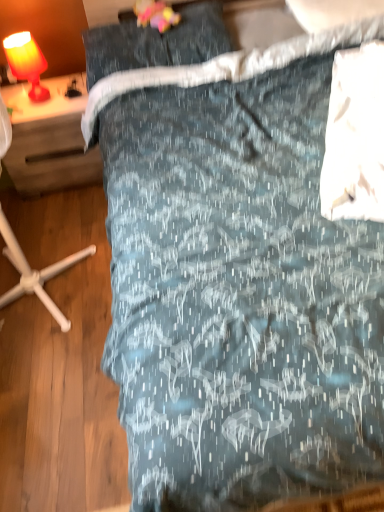
Describe the element at coordinates (49, 138) in the screenshot. I see `matte wood desk at left` at that location.

Measure the distance between matte wood desk at left and camera.

1.88 meters.

This screenshot has width=384, height=512. I want to click on matte orange lamp at upper left, so click(27, 62).

Looking at their sizes, would you say dark gray fabric pillow at upper center is wider or thinner than matte wood desk at left?

Considering their sizes, dark gray fabric pillow at upper center looks slimmer than matte wood desk at left.

From the image's perspective, would you say dark gray fabric pillow at upper center is shown under matte wood desk at left?

No.

Is matte wood desk at left at the back of dark gray fabric pillow at upper center?

No, dark gray fabric pillow at upper center is not facing the opposite direction of matte wood desk at left.

Looking at this image, would you say dark gray fabric pillow at upper center is to the left or to the right of matte wood desk at left in the picture?

Based on their positions, dark gray fabric pillow at upper center is located to the right of matte wood desk at left.

Is matte orange lamp at upper left bigger or smaller than matte wood desk at left?

matte orange lamp at upper left is smaller than matte wood desk at left.

Does matte orange lamp at upper left have a greater width compared to matte wood desk at left?

In fact, matte orange lamp at upper left might be narrower than matte wood desk at left.

From the image's perspective, does matte orange lamp at upper left appear higher than matte wood desk at left?

Yes.

Does dark gray fabric pillow at upper center have a lesser height compared to matte orange lamp at upper left?

Indeed, dark gray fabric pillow at upper center has a lesser height compared to matte orange lamp at upper left.

Where is `pillow in front of the matte orange lamp at upper left`? The image size is (384, 512). pillow in front of the matte orange lamp at upper left is located at coordinates (157, 42).

From the image's perspective, is dark gray fabric pillow at upper center over matte orange lamp at upper left?

Yes, from the image's perspective, dark gray fabric pillow at upper center is on top of matte orange lamp at upper left.

Does matte wood desk at left turn towards dark gray fabric pillow at upper center?

No, matte wood desk at left does not turn towards dark gray fabric pillow at upper center.

From a real-world perspective, relative to dark gray fabric pillow at upper center, is matte wood desk at left vertically above or below?

matte wood desk at left is situated lower than dark gray fabric pillow at upper center in the real world.

Which of these two, matte wood desk at left or dark gray fabric pillow at upper center, is wider?

matte wood desk at left.

In the image, is matte wood desk at left positioned in front of or behind dark gray fabric pillow at upper center?

Visually, matte wood desk at left is located behind dark gray fabric pillow at upper center.

How far apart are matte wood desk at left and matte orange lamp at upper left?

7.96 inches.

Is matte wood desk at left facing towards matte orange lamp at upper left?

No, matte wood desk at left does not turn towards matte orange lamp at upper left.

From a real-world perspective, is matte wood desk at left above or below matte orange lamp at upper left?

In terms of real-world spatial position, matte wood desk at left is below matte orange lamp at upper left.

Which is more distant, [60,126] or [6,41]?

Point [60,126]

From the image's perspective, is matte orange lamp at upper left above or below dark gray fabric pillow at upper center?

Based on their image positions, matte orange lamp at upper left is located beneath dark gray fabric pillow at upper center.

Is matte orange lamp at upper left thinner than dark gray fabric pillow at upper center?

Indeed, matte orange lamp at upper left has a lesser width compared to dark gray fabric pillow at upper center.

Visually, is matte orange lamp at upper left positioned to the left or to the right of dark gray fabric pillow at upper center?

In the image, matte orange lamp at upper left appears on the left side of dark gray fabric pillow at upper center.

Which point is more forward, (x=7, y=38) or (x=100, y=42)?

The point (x=100, y=42) is in front.

At what (x,y) coordinates should I click in order to perform the action: click on desk that appears below the dark gray fabric pillow at upper center (from a real-world perspective). Please return your answer as a coordinate pair (x, y). The height and width of the screenshot is (512, 384). Looking at the image, I should click on pos(49,138).

Locate an element on the screen. desk lying on the right of matte orange lamp at upper left is located at coordinates (49, 138).

From the image, which object appears to be nearer to matte wood desk at left, dark gray fabric pillow at upper center or matte orange lamp at upper left?

The object closer to matte wood desk at left is matte orange lamp at upper left.

Estimate the real-world distances between objects in this image. Which object is further from matte orange lamp at upper left, matte wood desk at left or dark gray fabric pillow at upper center?

dark gray fabric pillow at upper center lies further to matte orange lamp at upper left than the other object.

Considering their positions, is dark gray fabric pillow at upper center positioned further to matte orange lamp at upper left than matte wood desk at left?

dark gray fabric pillow at upper center.

When comparing their distances from dark gray fabric pillow at upper center, does matte orange lamp at upper left or matte wood desk at left seem closer?

matte wood desk at left is closer to dark gray fabric pillow at upper center.

Looking at the image, which one is located closer to matte wood desk at left, matte orange lamp at upper left or dark gray fabric pillow at upper center?

Based on the image, matte orange lamp at upper left appears to be nearer to matte wood desk at left.

From the picture: Based on their spatial positions, is matte wood desk at left or matte orange lamp at upper left closer to dark gray fabric pillow at upper center?

matte wood desk at left.

The width and height of the screenshot is (384, 512). I want to click on desk located between matte orange lamp at upper left and dark gray fabric pillow at upper center in the left-right direction, so click(49, 138).